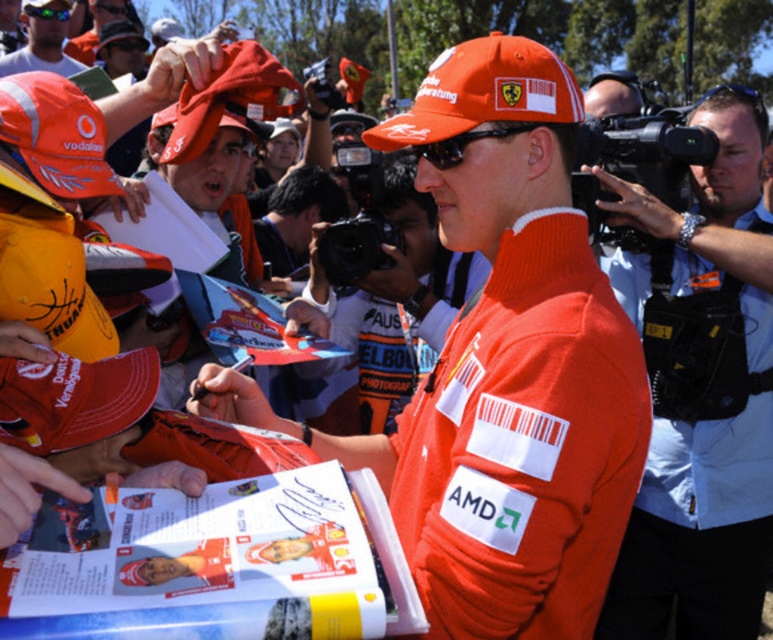
You are a photographer at the event and need to capture a clear shot of both the orange fabric shirt at right and the orange fabric cap at upper left. Which object should you focus on first to ensure it appears larger in the photo?

The orange fabric shirt at right has a greater height compared to the orange fabric cap at upper left, so focusing on it first will ensure it appears larger in the photo.

You are a photographer trying to capture a clear shot of the public figure. You notice two orange fabric caps in the crowd. Which cap is narrower in width, the orange fabric cap at lower left or the orange fabric cap at upper left?

The orange fabric cap at lower left has a lesser width compared to orange fabric cap at upper left, so the orange fabric cap at lower left is narrower in width.